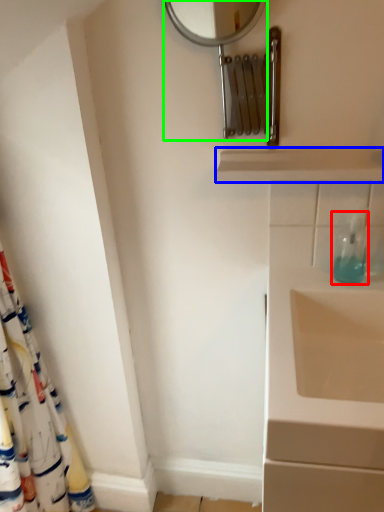
Question: Based on their relative distances, which object is farther from soap dispenser (highlighted by a red box)? Choose from balustrade (highlighted by a blue box) and mirror (highlighted by a green box).

Choices:
 (A) balustrade
 (B) mirror

Answer: (B)